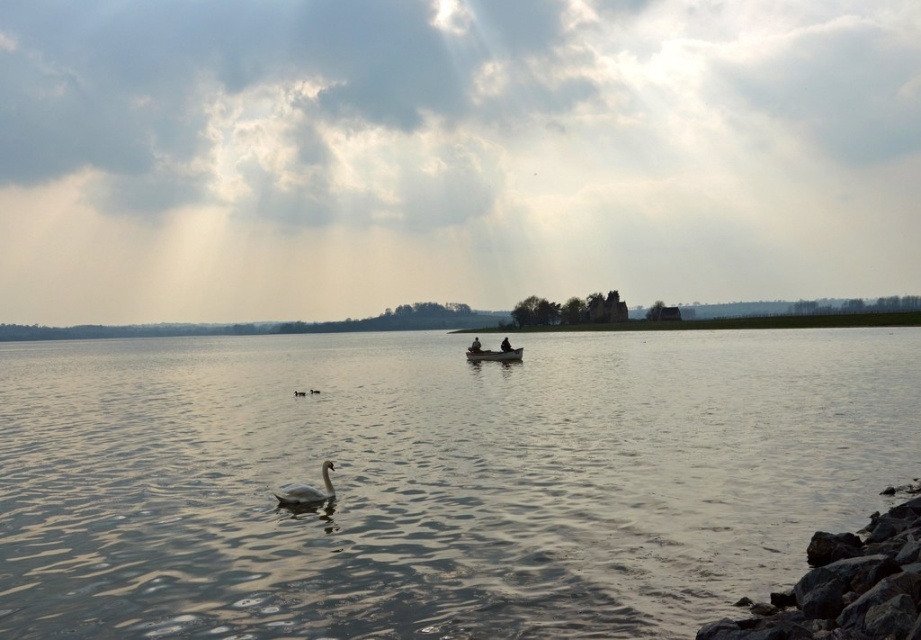
Does white glossy swan at lower center appear under black matte person at center?

Indeed, white glossy swan at lower center is positioned under black matte person at center.

Who is shorter, white glossy swan at lower center or black matte person at center?

With less height is white glossy swan at lower center.

Find the location of a particular element. white glossy swan at lower center is located at coordinates (306, 490).

Who is positioned more to the left, white glossy swan at lower center or black matte boat at center?

white glossy swan at lower center is more to the left.

Consider the image. Who is more distant from viewer, [325,500] or [480,348]?

Point [480,348]

Which is in front, point (317, 502) or point (475, 346)?

Point (317, 502)

You are a GUI agent. You are given a task and a screenshot of the screen. Output one action in this format:
    pyautogui.click(x=<x>, y=<y>)
    Task: Click on the white glossy swan at lower center
    This screenshot has height=640, width=921.
    Given the screenshot: What is the action you would take?
    [306, 490]

Which is in front, point (118, 433) or point (510, 346)?

Point (118, 433)

Between clear water at center and black matte person at center, which one has more height?

Standing taller between the two is clear water at center.

Is point (47, 636) farther from camera compared to point (506, 346)?

No, it is in front of (506, 346).

Image resolution: width=921 pixels, height=640 pixels. I want to click on clear water at center, so [x=436, y=481].